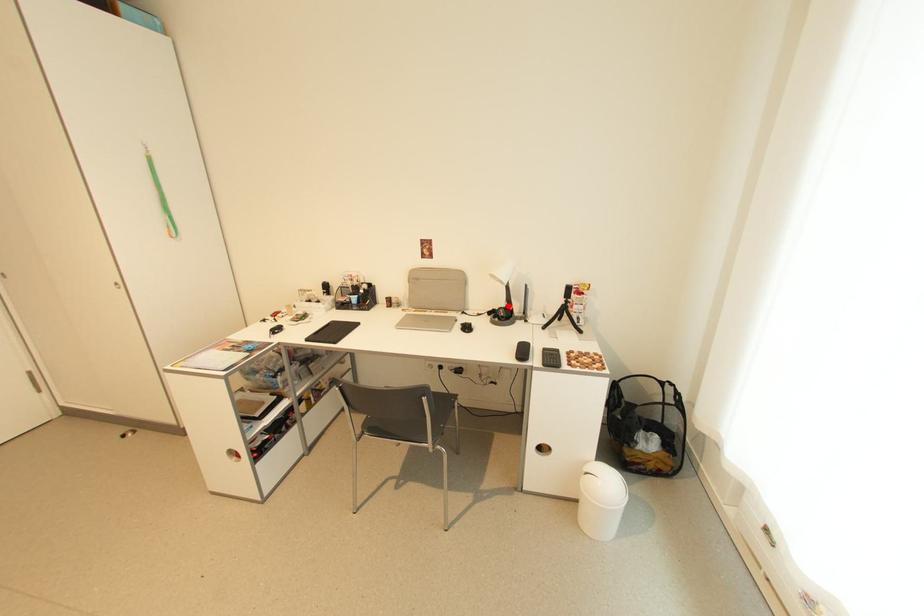
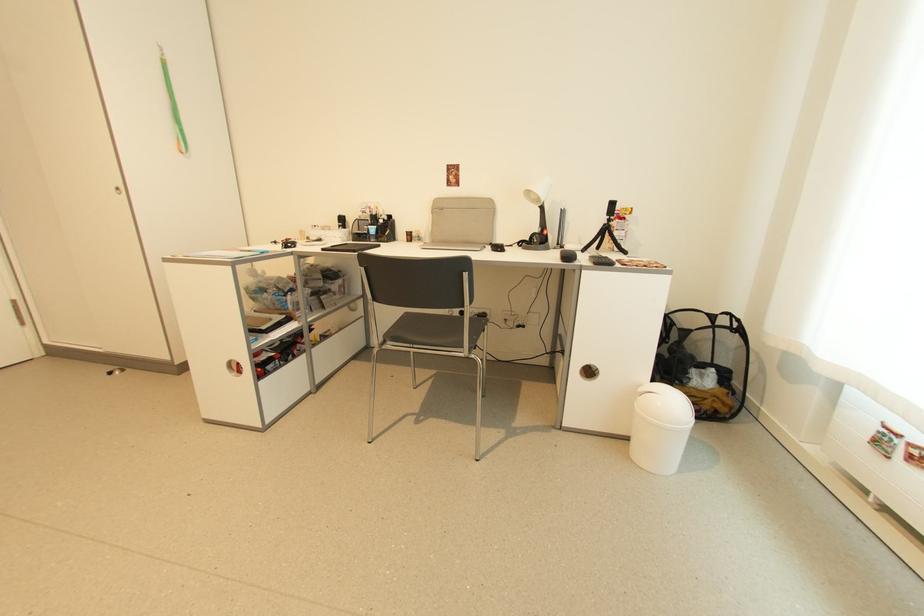
The point at the highlighted location is marked in the first image. Where is the corresponding point in the second image?

(541, 232)